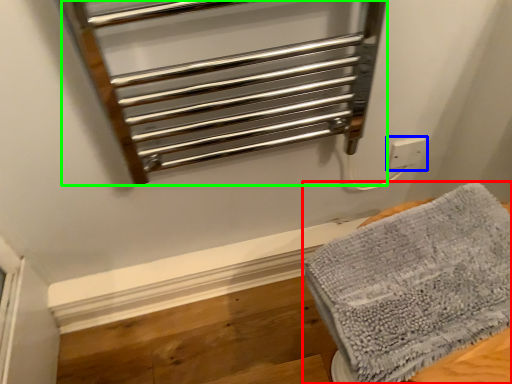
Question: Which object is positioned closest to towel (highlighted by a red box)? Select from electric outlet (highlighted by a blue box) and cage (highlighted by a green box).

Choices:
 (A) electric outlet
 (B) cage

Answer: (B)